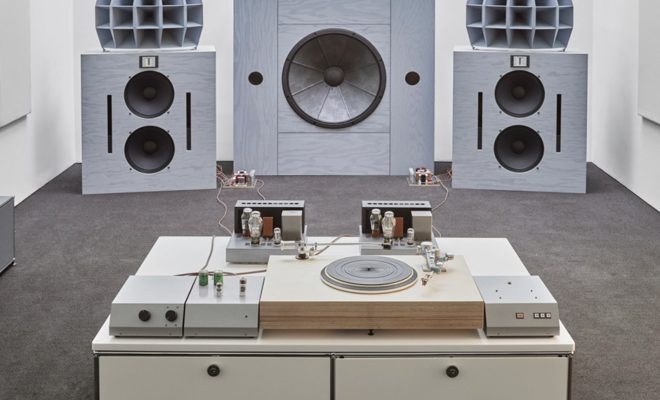
Find the location of a particular element. This screenshot has width=660, height=400. wall is located at coordinates (22, 153), (222, 119), (637, 155).